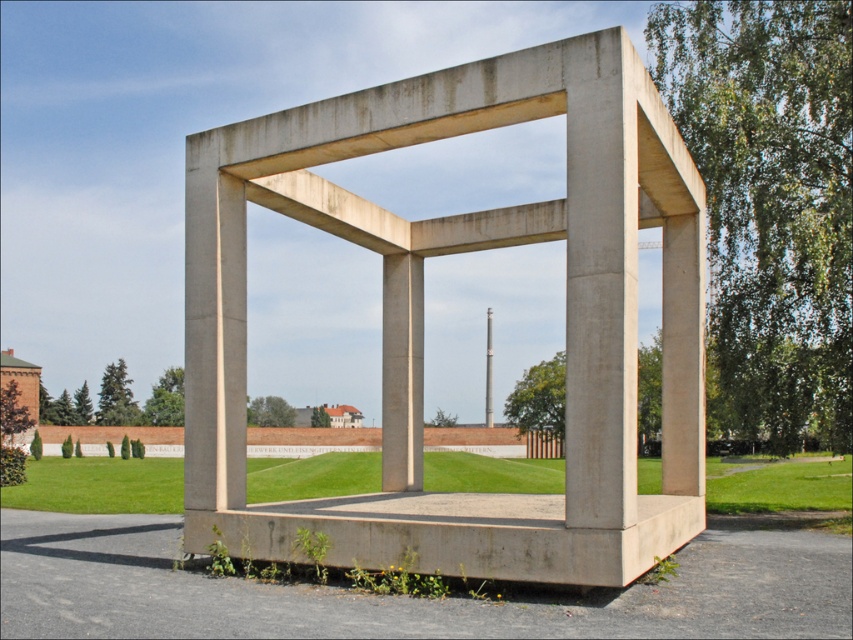
Who is positioned more to the right, concrete frame at center or concrete/rough pillar at center?

From the viewer's perspective, concrete/rough pillar at center appears more on the right side.

Does concrete frame at center have a lesser height compared to concrete/rough pillar at center?

Correct, concrete frame at center is not as tall as concrete/rough pillar at center.

Which is behind, point (383, 378) or point (486, 358)?

The point (486, 358) is more distant.

Where is `concrete frame at center`? concrete frame at center is located at coordinates pyautogui.click(x=422, y=314).

Is point (665, 618) positioned before point (486, 422)?

Yes.

Is smooth concrete frame at center smaller than concrete/rough pillar at center?

Yes.

Does point (436, 630) come farther from viewer compared to point (485, 412)?

No, (436, 630) is closer to viewer.

Find the location of a particular element. Image resolution: width=853 pixels, height=640 pixels. smooth concrete frame at center is located at coordinates (402, 596).

Is concrete frame at center shorter than smooth concrete frame at center?

No.

Can you confirm if concrete frame at center is taller than smooth concrete frame at center?

Correct, concrete frame at center is much taller as smooth concrete frame at center.

Does point (579, 204) come farther from viewer compared to point (762, 589)?

No, it is not.

What are the coordinates of `concrete frame at center` in the screenshot? It's located at (422, 314).